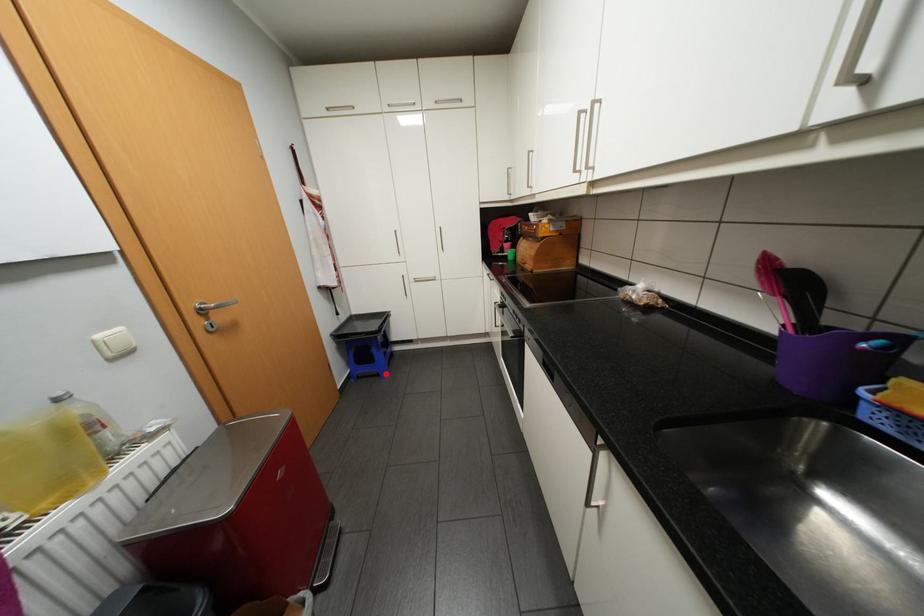
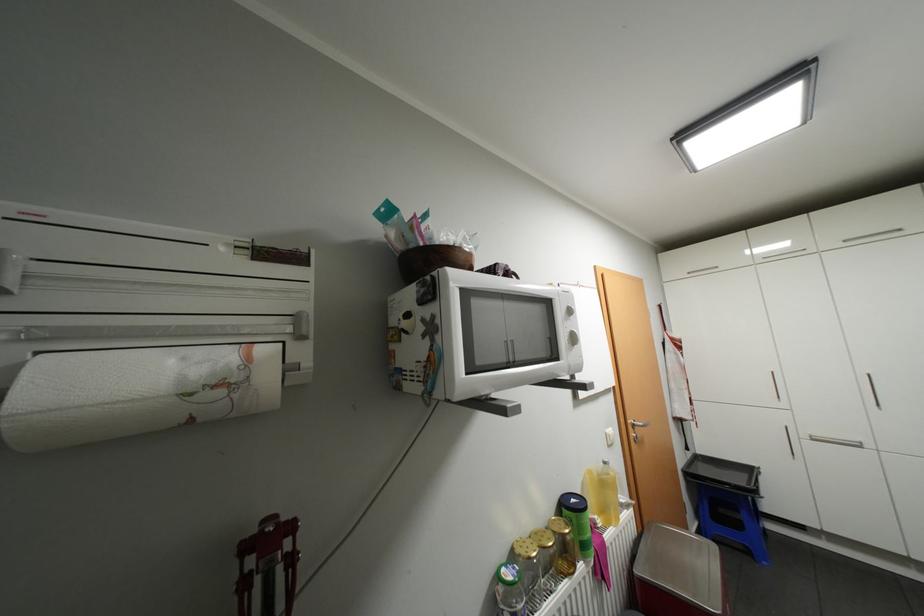
Question: I am providing you with two images of the same scene from different viewpoints. In image1, a red point is highlighted. Considering the same 3D point in image2, which of the following is correct?

Choices:
 (A) It is closer
 (B) It is farther

Answer: (A)